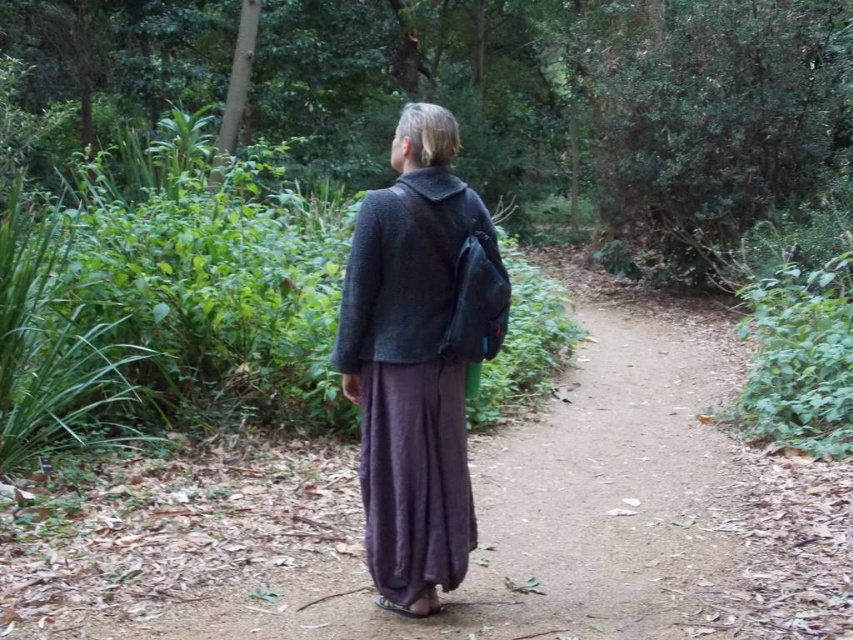
You are a hiker who wants to pick up both jackets from the center of the forest path. How far apart are the dark gray fabric jacket at center and the dark gray woolen jacket at center?

The dark gray fabric jacket at center and the dark gray woolen jacket at center are 8.86 centimeters apart.

You are a hiker preparing to go on a trail hike. You see the dark gray fabric jacket at center and the dark gray woolen jacket at center in your backpack. Which jacket should you put on first to ensure proper layering?

You should put on the dark gray woolen jacket at center first because the dark gray fabric jacket at center is below it, indicating it should be worn as an outer layer.

You are a hiker on the dirt path in the forest. You notice two points marked on the path. One is at coordinate point (444, 564) and the other at point (399, 289). If you want to reach the point closer to you, which coordinate should you head towards?

Point (444, 564) is closer to the camera, so you should head towards point (444, 564).